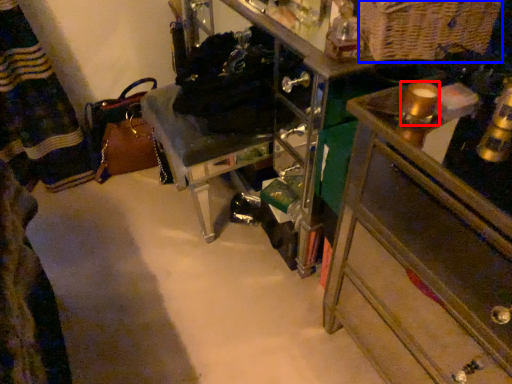
Question: Which of the following is the farthest to the observer, beverage (highlighted by a red box) or basket (highlighted by a blue box)?

Choices:
 (A) beverage
 (B) basket

Answer: (B)